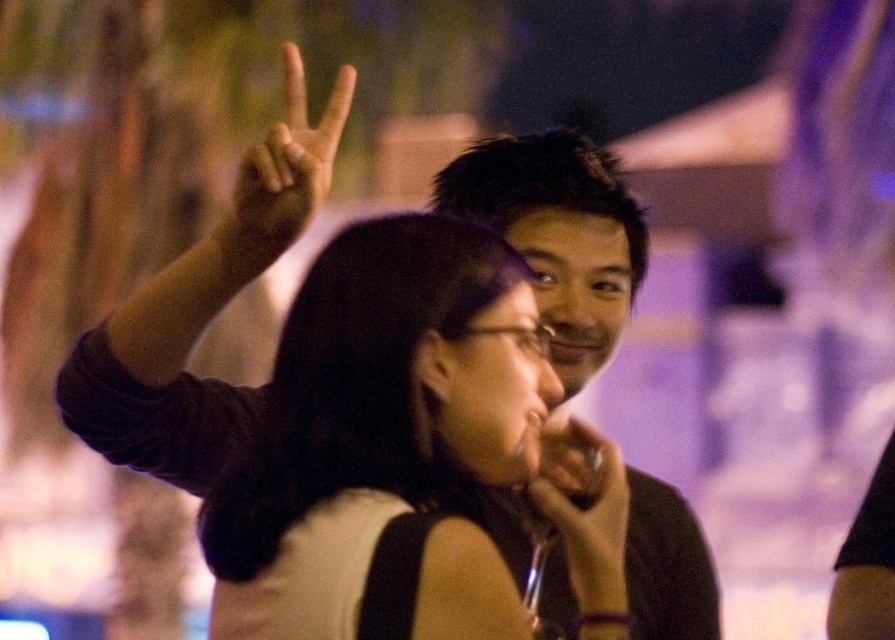
Which of these two, black matte hair at upper center or matte black hand at upper center, stands shorter?

matte black hand at upper center

Between black matte hair at upper center and matte black hand at upper center, which one is positioned higher?

matte black hand at upper center is higher up.

Locate an element on the screen. The width and height of the screenshot is (895, 640). black matte hair at upper center is located at coordinates (356, 380).

Which is below, matte black shirt at center or matte black hand at center?

matte black hand at center is below.

Looking at this image, does matte black shirt at center appear over matte black hand at center?

Yes.

Is point (500, 493) positioned behind point (539, 500)?

Yes.

The width and height of the screenshot is (895, 640). Find the location of `matte black shirt at center`. matte black shirt at center is located at coordinates (199, 314).

Who is lower down, black matte hair at center or matte black hand at center?

Positioned lower is matte black hand at center.

Is black matte hair at center positioned before matte black hand at center?

No, it is not.

Where is `black matte hair at center`? The height and width of the screenshot is (640, 895). black matte hair at center is located at coordinates (558, 236).